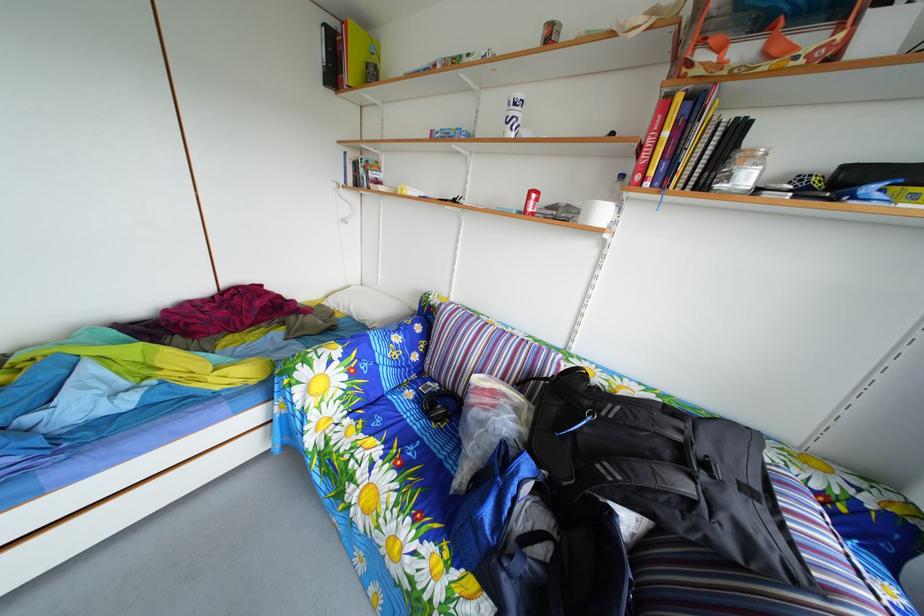
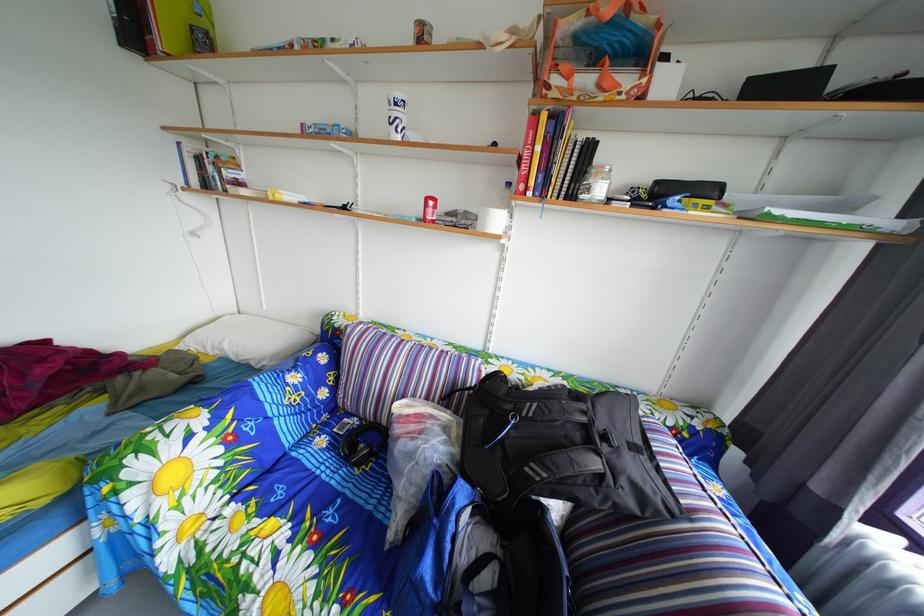
Locate, in the second image, the point that corresponds to point (396, 428) in the first image.

(301, 493)